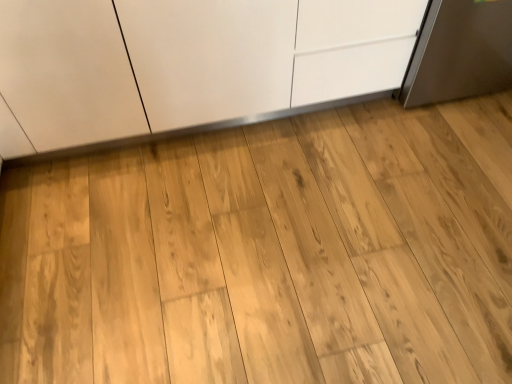
Question: Can you confirm if matte white cabinet at center is taller than natural wood dresser at center?

Choices:
 (A) yes
 (B) no

Answer: (A)

Question: Does matte white cabinet at center have a greater width compared to natural wood dresser at center?

Choices:
 (A) yes
 (B) no

Answer: (B)

Question: Is matte white cabinet at center far away from natural wood dresser at center?

Choices:
 (A) yes
 (B) no

Answer: (B)

Question: Considering the relative sizes of matte white cabinet at center and natural wood dresser at center in the image provided, is matte white cabinet at center smaller than natural wood dresser at center?

Choices:
 (A) no
 (B) yes

Answer: (A)

Question: Is the position of matte white cabinet at center less distant than that of natural wood dresser at center?

Choices:
 (A) yes
 (B) no

Answer: (B)

Question: From the image's perspective, is matte white cabinet at center below natural wood dresser at center?

Choices:
 (A) yes
 (B) no

Answer: (B)

Question: From the image's perspective, is natural wood dresser at center on matte white cabinet at center?

Choices:
 (A) no
 (B) yes

Answer: (A)

Question: Is natural wood dresser at center smaller than matte white cabinet at center?

Choices:
 (A) no
 (B) yes

Answer: (B)

Question: From a real-world perspective, is natural wood dresser at center beneath matte white cabinet at center?

Choices:
 (A) no
 (B) yes

Answer: (B)

Question: Does natural wood dresser at center have a greater height compared to matte white cabinet at center?

Choices:
 (A) yes
 (B) no

Answer: (B)

Question: Can you confirm if natural wood dresser at center is wider than matte white cabinet at center?

Choices:
 (A) no
 (B) yes

Answer: (B)

Question: Is natural wood dresser at center turned away from matte white cabinet at center?

Choices:
 (A) no
 (B) yes

Answer: (A)

Question: From the image's perspective, is natural wood dresser at center above or below matte white cabinet at center?

Choices:
 (A) below
 (B) above

Answer: (A)